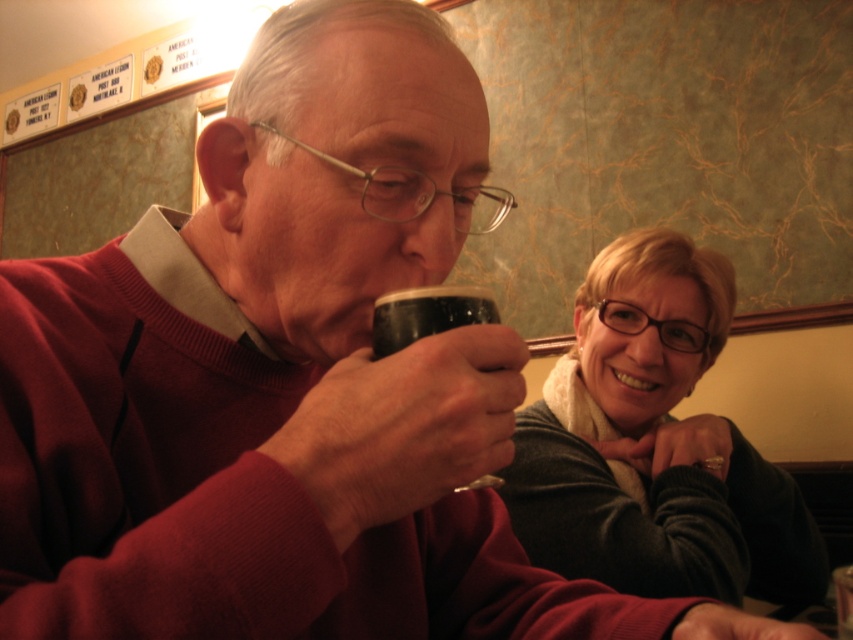
Locate an element on the screen. The image size is (853, 640). matte black sweater at upper right is located at coordinates (654, 444).

Who is positioned more to the left, matte black sweater at upper right or black matte cup at center?

black matte cup at center

At what (x,y) coordinates should I click in order to perform the action: click on matte black sweater at upper right. Please return your answer as a coordinate pair (x, y). This screenshot has height=640, width=853. Looking at the image, I should click on (654, 444).